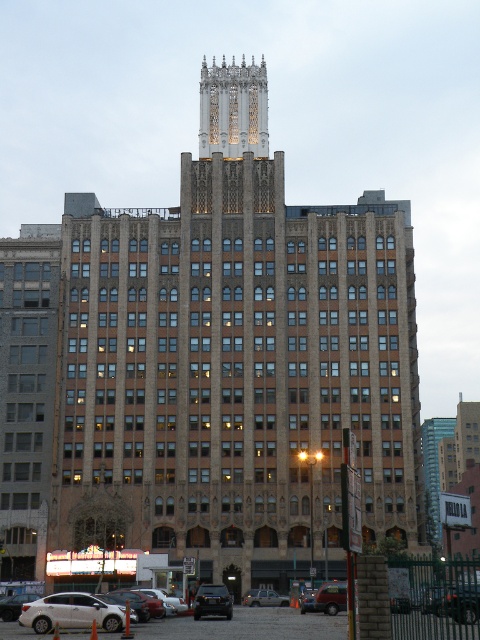
You are standing in front of the building and want to determine the relative positions of two points marked on its facade. The points are labeled as point 1 at coordinates point [219,589] and point 2 at coordinates point [247,596]. Which point is positioned closer to you?

Point [219,589] is closer to the viewer than point [247,596].

You are standing in front of the building and notice two points marked on its facade. The first point is at coordinates point (228, 456) and the second is at point (219, 596). From your perspective, which point appears closer to you?

Point (219, 596) appears closer because it is in front of point (228, 456) according to their positions.

You are a parking attendant and need to fit both the shiny black suv at center and the matte black suv at center into a parking spot that can accommodate a vehicle up to 6 feet in height. Given their height difference, which SUV should you park first to ensure both fit?

The shiny black suv at center is taller than the matte black suv at center. Since the parking spot has a height limit of 6 feet, you should first check the height of the taller SUV. If it is under 6 feet, both can fit. If not, only the matte black suv at center can be parked.